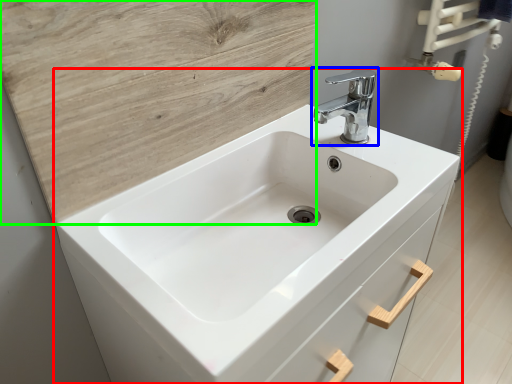
Question: Considering the real-world distances, which object is closest to sink (highlighted by a red box)? tap (highlighted by a blue box) or plywood (highlighted by a green box).

Choices:
 (A) tap
 (B) plywood

Answer: (B)